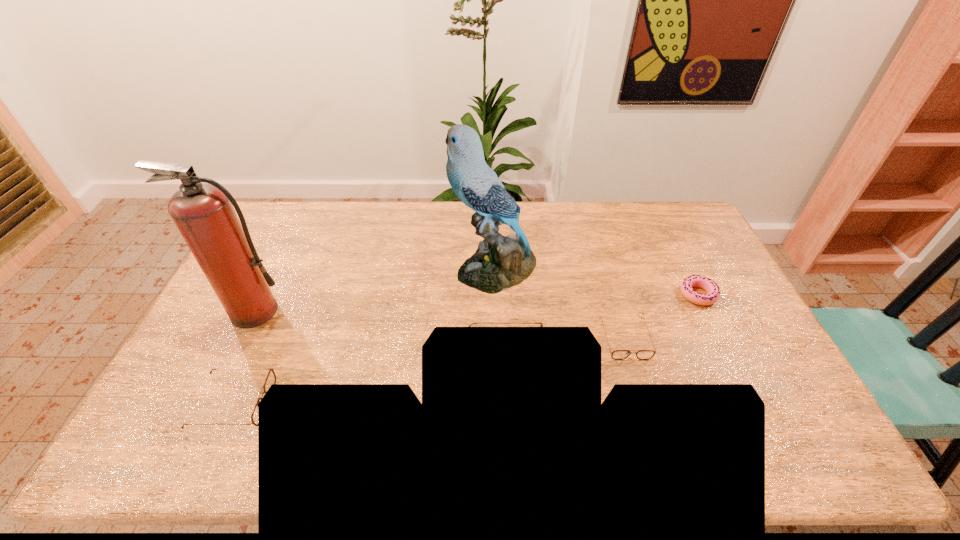
If equal spacing is desired by inserting an extra sunglasses among them, please point out a free spot for this new sunglasses. Please provide its 2D coordinates. Your answer should be formatted as a tuple, i.e. [(x, y)], where the tuple contains the x and y coordinates of a point satisfying the conditions above.

[(375, 380)]